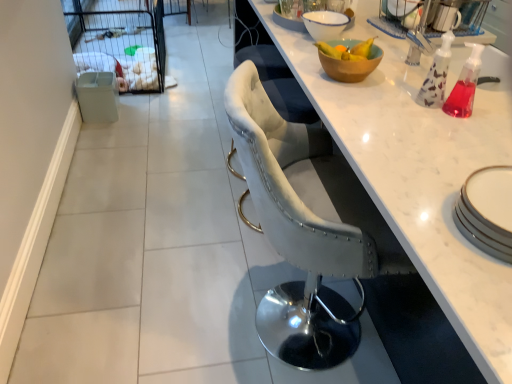
Question: Is white ceramic bowl at upper center, positioned as the 1th bowl in top-to-bottom order, oriented away from wooden bowl at upper right, the 1th bowl positioned from the bottom?

Choices:
 (A) no
 (B) yes

Answer: (A)

Question: Are white ceramic bowl at upper center, arranged as the 2th bowl when ordered from the bottom, and wooden bowl at upper right, the 2th bowl positioned from the back, far apart?

Choices:
 (A) no
 (B) yes

Answer: (A)

Question: Is white ceramic bowl at upper center, arranged as the 2th bowl when ordered from the bottom, located outside wooden bowl at upper right, the 1th bowl positioned from the front?

Choices:
 (A) yes
 (B) no

Answer: (A)

Question: Can you confirm if white ceramic bowl at upper center, positioned as the 1th bowl in top-to-bottom order, is bigger than wooden bowl at upper right, the 1th bowl positioned from the front?

Choices:
 (A) no
 (B) yes

Answer: (A)

Question: Does white ceramic bowl at upper center, positioned as the 1th bowl in top-to-bottom order, have a smaller size compared to wooden bowl at upper right, the 1th bowl positioned from the bottom?

Choices:
 (A) no
 (B) yes

Answer: (B)

Question: From a real-world perspective, is white ceramic bowl at upper center, the 2th bowl when ordered from front to back, beneath wooden bowl at upper right, the 2th bowl viewed from the top?

Choices:
 (A) yes
 (B) no

Answer: (B)

Question: Does white mesh screen door at upper left have a greater height compared to velvet grey chair at center?

Choices:
 (A) no
 (B) yes

Answer: (A)

Question: Does white mesh screen door at upper left have a larger size compared to velvet grey chair at center?

Choices:
 (A) no
 (B) yes

Answer: (B)

Question: Considering the relative sizes of white mesh screen door at upper left and velvet grey chair at center in the image provided, is white mesh screen door at upper left smaller than velvet grey chair at center?

Choices:
 (A) yes
 (B) no

Answer: (B)

Question: Is white mesh screen door at upper left directly adjacent to velvet grey chair at center?

Choices:
 (A) yes
 (B) no

Answer: (B)

Question: Is white mesh screen door at upper left shorter than velvet grey chair at center?

Choices:
 (A) no
 (B) yes

Answer: (B)

Question: From the image's perspective, is white mesh screen door at upper left under velvet grey chair at center?

Choices:
 (A) yes
 (B) no

Answer: (B)

Question: Does velvet grey chair at center have a lesser height compared to wooden bowl at upper right, the 2th bowl viewed from the top?

Choices:
 (A) no
 (B) yes

Answer: (A)